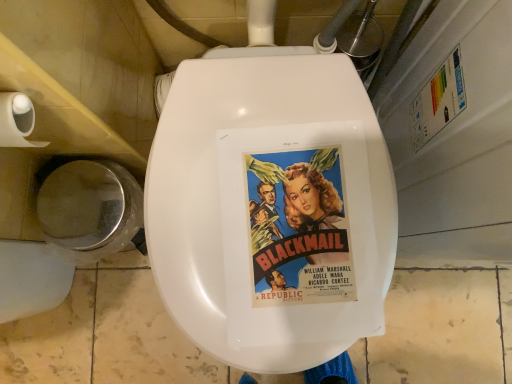
Question: From the image's perspective, is shiny metallic toilet bowl at lower left located above or below white matte toilet paper at left?

Choices:
 (A) below
 (B) above

Answer: (A)

Question: In terms of height, does shiny metallic toilet bowl at lower left look taller or shorter compared to white matte toilet paper at left?

Choices:
 (A) short
 (B) tall

Answer: (B)

Question: Which object is positioned closest to the shiny metallic toilet bowl at lower left?

Choices:
 (A) white matte toilet paper at left
 (B) vivid paper movie poster at center

Answer: (A)

Question: Estimate the real-world distances between objects in this image. Which object is farther from the white matte toilet paper at left?

Choices:
 (A) shiny metallic toilet bowl at lower left
 (B) vivid paper movie poster at center

Answer: (B)